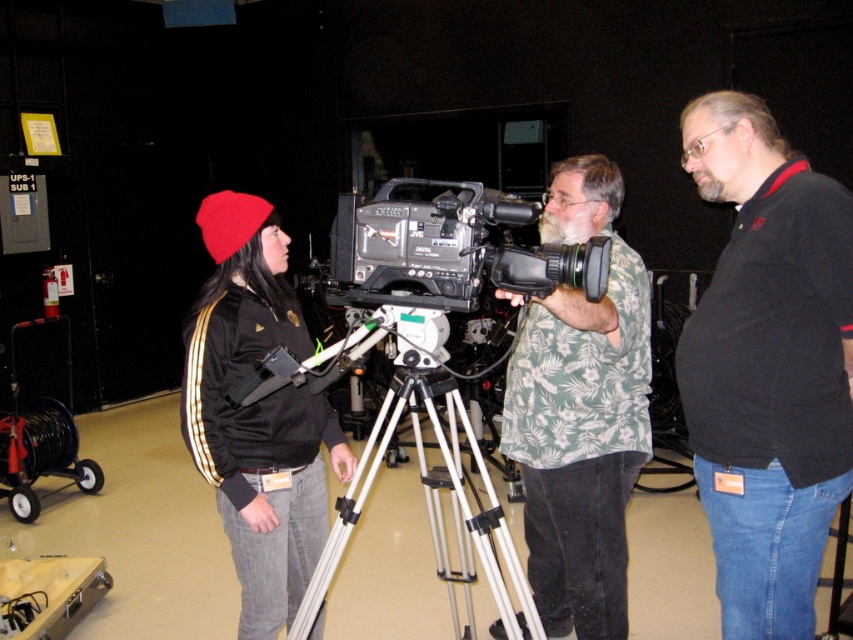
Can you confirm if green floral shirt at center is smaller than silver metallic camera at center?

No.

Is green floral shirt at center further to camera compared to silver metallic camera at center?

No.

What do you see at coordinates (581, 412) in the screenshot?
I see `green floral shirt at center` at bounding box center [581, 412].

In order to click on green floral shirt at center in this screenshot , I will do `click(581, 412)`.

Is shiny black jacket at center to the left of silver metallic tripod at center from the viewer's perspective?

Indeed, shiny black jacket at center is positioned on the left side of silver metallic tripod at center.

Is shiny black jacket at center below silver metallic tripod at center?

Actually, shiny black jacket at center is above silver metallic tripod at center.

Identify the location of shiny black jacket at center. The height and width of the screenshot is (640, 853). (257, 413).

Find the location of a particular element. shiny black jacket at center is located at coordinates (257, 413).

Which of these two, silver metallic camera at center or silver metallic tripod at center, stands shorter?

silver metallic camera at center

Is silver metallic camera at center to the left of silver metallic tripod at center from the viewer's perspective?

No, silver metallic camera at center is not to the left of silver metallic tripod at center.

Which is behind, point (515, 216) or point (491, 492)?

The point (491, 492) is behind.

Locate an element on the screen. silver metallic camera at center is located at coordinates (450, 250).